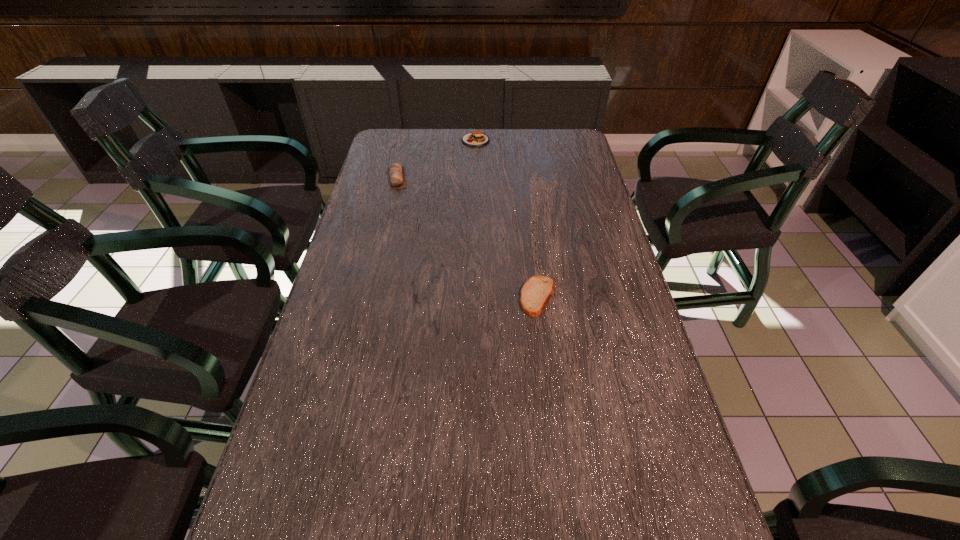
Locate an element on the screen. Image resolution: width=960 pixels, height=540 pixels. the farthest object is located at coordinates (477, 138).

At what (x,y) coordinates should I click in order to perform the action: click on the second object from left to right. Please return your answer as a coordinate pair (x, y). Looking at the image, I should click on (477, 138).

At what (x,y) coordinates should I click in order to perform the action: click on the left pita bread. Please return your answer as a coordinate pair (x, y). The width and height of the screenshot is (960, 540). Looking at the image, I should click on (396, 177).

You are a GUI agent. You are given a task and a screenshot of the screen. Output one action in this format:
    pyautogui.click(x=<x>, y=<y>)
    Task: Click on the leftmost object
    The width and height of the screenshot is (960, 540).
    Given the screenshot: What is the action you would take?
    pyautogui.click(x=396, y=177)

I want to click on the shortest object, so click(537, 290).

Find the location of a particular element. The image size is (960, 540). the rightmost object is located at coordinates (537, 290).

The height and width of the screenshot is (540, 960). I want to click on free space located 0.090m on the left of the farthest object, so click(x=438, y=140).

The image size is (960, 540). In order to click on vacant space situated on the back of the taller pita bread in this screenshot , I will do (x=402, y=154).

You are a GUI agent. You are given a task and a screenshot of the screen. Output one action in this format:
    pyautogui.click(x=<x>, y=<y>)
    Task: Click on the free space located on the left of the nearer pita bread
    The width and height of the screenshot is (960, 540).
    Given the screenshot: What is the action you would take?
    pyautogui.click(x=492, y=296)

The width and height of the screenshot is (960, 540). Identify the location of object located in the far edge section of the desktop. (477, 138).